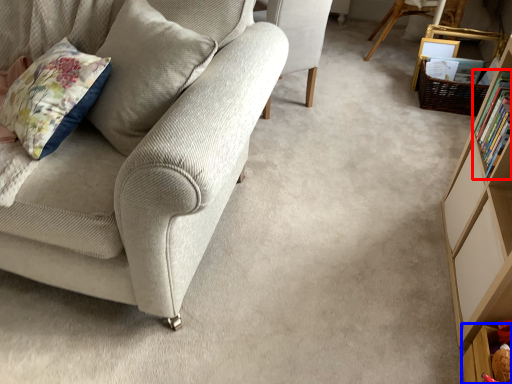
Question: Which of the following is the closest to the observer, book (highlighted by a red box) or shelf (highlighted by a blue box)?

Choices:
 (A) book
 (B) shelf

Answer: (B)